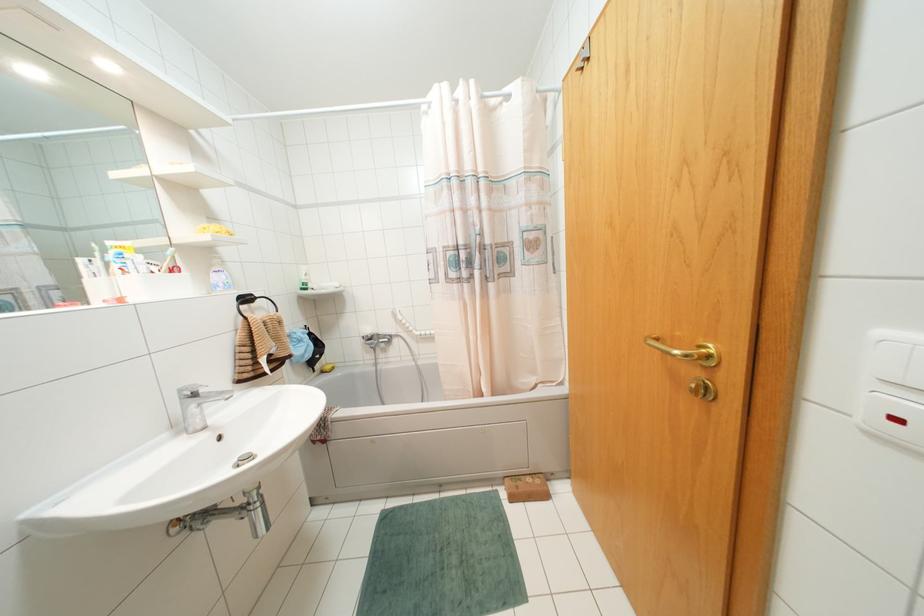
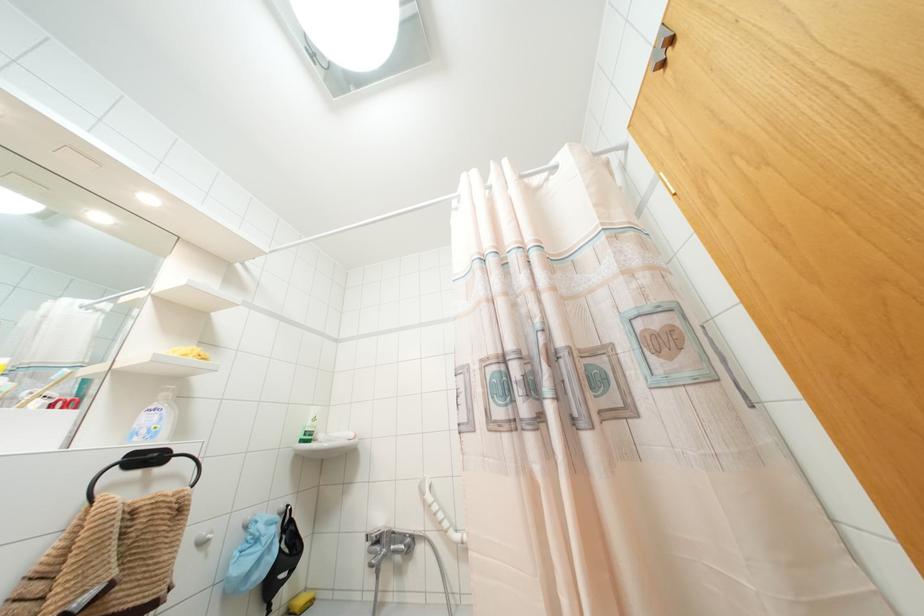
Locate, in the second image, the point that corresponds to [327,367] in the first image.

(299, 601)